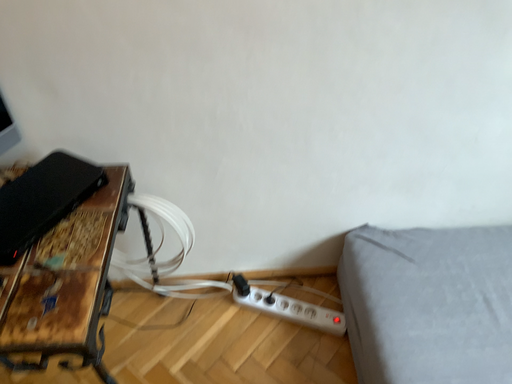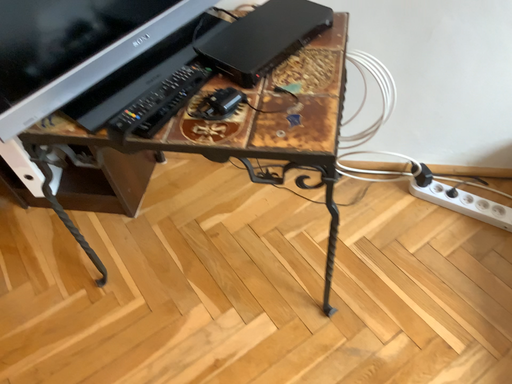
Question: How did the camera likely rotate when shooting the video?

Choices:
 (A) rotated right
 (B) rotated left

Answer: (B)